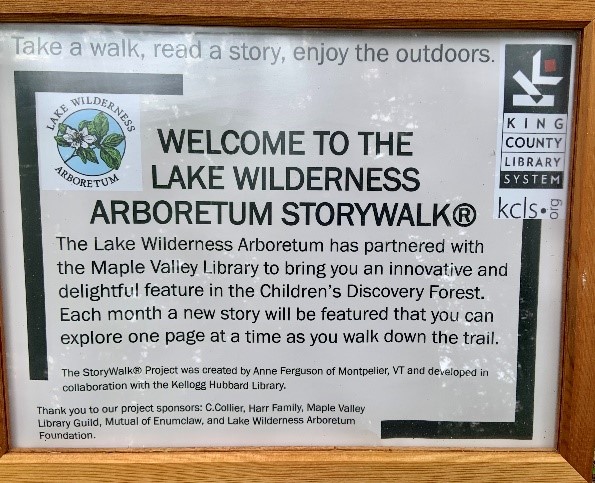
Locate an element on the screen. The width and height of the screenshot is (595, 483). artwork is located at coordinates pyautogui.click(x=99, y=170).